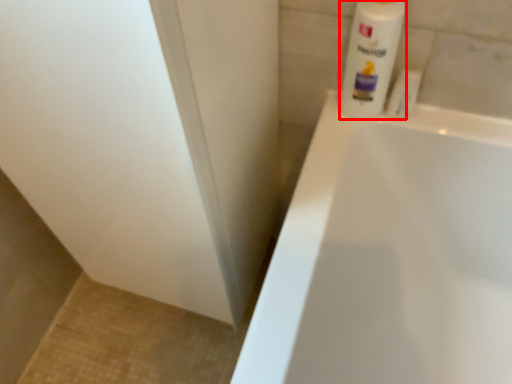
Question: From the image's perspective, where is cleaning product (annotated by the red box) located relative to toiletry?

Choices:
 (A) below
 (B) above

Answer: (B)